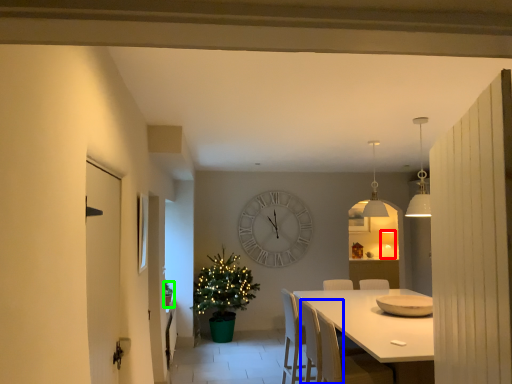
Question: Based on their relative distances, which object is farther from lamp (highlighted by a red box)? Choose from armchair (highlighted by a blue box) and houseplant (highlighted by a green box).

Choices:
 (A) armchair
 (B) houseplant

Answer: (B)